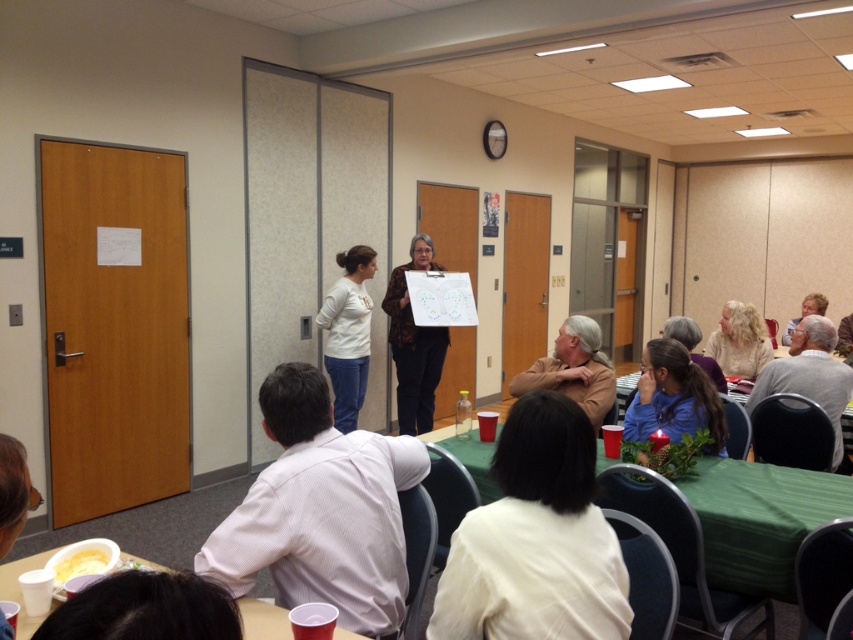
You are standing at the entrance of the room and see two points marked on the floor. The first point is at coordinate point(289, 531) and the second is at point(276, 625). Which point is closer to the entrance?

Point(276, 625) is closer to the entrance because it is in front of point(289, 531).

You are organizing a clothing donation drive and need to determine which item takes up more space when stored. Based on the scene, which item is wider between the blue matte shirt at lower right and the brown leather jacket at center?

The brown leather jacket at center is wider than the blue matte shirt at lower right, so it takes up more space when stored.